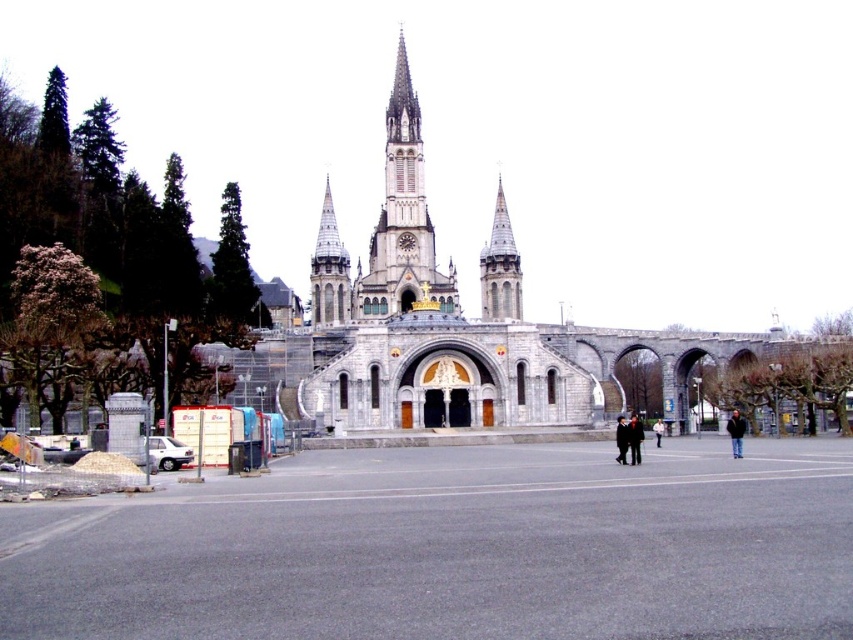
Is point (36, 516) less distant than point (583, 355)?

That is True.

Can you confirm if gray asphalt at center is smaller than gray stone church at center?

Correct, gray asphalt at center occupies less space than gray stone church at center.

The height and width of the screenshot is (640, 853). Describe the element at coordinates (453, 548) in the screenshot. I see `gray asphalt at center` at that location.

Where is `gray asphalt at center`? gray asphalt at center is located at coordinates (453, 548).

Can you confirm if smooth stone spire at center is smaller than dark gray coat at center?

No, smooth stone spire at center is not smaller than dark gray coat at center.

What do you see at coordinates (329, 269) in the screenshot?
I see `smooth stone spire at center` at bounding box center [329, 269].

Locate an element on the screen. smooth stone spire at center is located at coordinates (329, 269).

Is gray stone spire at center bigger than dark gray suit at center?

Indeed, gray stone spire at center has a larger size compared to dark gray suit at center.

Does gray stone spire at center appear under dark gray suit at center?

Incorrect, gray stone spire at center is not positioned below dark gray suit at center.

Which is in front, point (482, 317) or point (635, 445)?

Point (635, 445) is in front.

Find the location of a particular element. The width and height of the screenshot is (853, 640). gray stone spire at center is located at coordinates (500, 268).